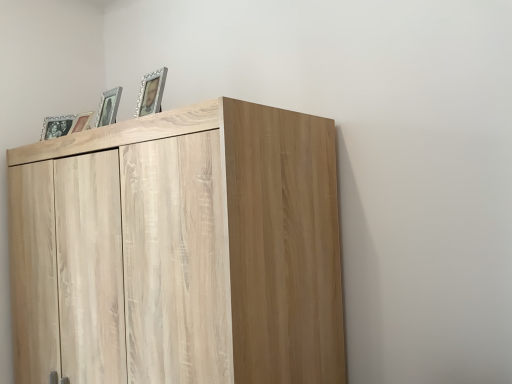
Measure the distance between silver metallic photo frame at upper center, the fourth picture frame viewed from the back, and camera.

The distance of silver metallic photo frame at upper center, the fourth picture frame viewed from the back, from camera is 4.08 feet.

What do you see at coordinates (151, 93) in the screenshot? I see `silver metallic photo frame at upper center, the fourth picture frame viewed from the back` at bounding box center [151, 93].

Where is `matte black picture frame at upper left, which appears as the first picture frame when viewed from the back`? The image size is (512, 384). matte black picture frame at upper left, which appears as the first picture frame when viewed from the back is located at coordinates (56, 126).

What do you see at coordinates (56, 126) in the screenshot? I see `matte black picture frame at upper left, which is the first picture frame from left to right` at bounding box center [56, 126].

Identify the location of matte silver picture frame at upper left, the 3th picture frame when ordered from left to right. (109, 107).

Is matte silver picture frame at upper left, which appears as the third picture frame when viewed from the back, not near silver metallic photo frame at upper center, marked as the 4th picture frame in a left-to-right arrangement?

No, matte silver picture frame at upper left, which appears as the third picture frame when viewed from the back, is in close proximity to silver metallic photo frame at upper center, marked as the 4th picture frame in a left-to-right arrangement.

Considering the points (113, 103) and (138, 109), which point is behind, point (113, 103) or point (138, 109)?

The point (138, 109) is farther from the camera.

Is matte silver picture frame at upper left, which appears as the third picture frame when viewed from the back, oriented away from silver metallic photo frame at upper center, marked as the 4th picture frame in a left-to-right arrangement?

No, matte silver picture frame at upper left, which appears as the third picture frame when viewed from the back, is not facing away from silver metallic photo frame at upper center, marked as the 4th picture frame in a left-to-right arrangement.

From the image's perspective, is light wood cupboard at upper left below matte black picture frame at upper left, which is the fourth picture frame in right-to-left order?

Yes, from the image's perspective, light wood cupboard at upper left is below matte black picture frame at upper left, which is the fourth picture frame in right-to-left order.

From a real-world perspective, which is physically above, light wood cupboard at upper left or matte black picture frame at upper left, positioned as the fourth picture frame in front-to-back order?

From a 3D spatial view, matte black picture frame at upper left, positioned as the fourth picture frame in front-to-back order, is above.

Which picture frame is the 3rd one when counting from the left side of the light wood cupboard at upper left? Please provide its 2D coordinates.

[(56, 126)]

Does matte black picture frame at upper left, which is the fourth picture frame in right-to-left order, have a greater width compared to light wood cupboard at upper left?

In fact, matte black picture frame at upper left, which is the fourth picture frame in right-to-left order, might be narrower than light wood cupboard at upper left.

From the image's perspective, is matte black picture frame at upper left, which is the fourth picture frame in right-to-left order, located above light wood cupboard at upper left?

Correct, matte black picture frame at upper left, which is the fourth picture frame in right-to-left order, appears higher than light wood cupboard at upper left in the image.

Is light wood cupboard at upper left at the back of matte black picture frame at upper left, which appears as the first picture frame when viewed from the back?

matte black picture frame at upper left, which appears as the first picture frame when viewed from the back, is not turned away from light wood cupboard at upper left.

Considering the sizes of light wood cupboard at upper left and matte silver picture frame at upper left, the second picture frame positioned from the right, in the image, is light wood cupboard at upper left taller or shorter than matte silver picture frame at upper left, the second picture frame positioned from the right,?

Clearly, light wood cupboard at upper left is taller compared to matte silver picture frame at upper left, the second picture frame positioned from the right.

Choose the correct answer: Is light wood cupboard at upper left inside matte silver picture frame at upper left, which appears as the third picture frame when viewed from the back, or outside it?

light wood cupboard at upper left cannot be found inside matte silver picture frame at upper left, which appears as the third picture frame when viewed from the back.

Locate an element on the screen. Image resolution: width=512 pixels, height=384 pixels. cupboard on the right of the matte silver picture frame at upper left, the 3th picture frame when ordered from left to right is located at coordinates (179, 250).

Between light wood cupboard at upper left and matte silver picture frame at upper left, which appears as the third picture frame when viewed from the back, which one appears on the left side from the viewer's perspective?

Positioned to the left is matte silver picture frame at upper left, which appears as the third picture frame when viewed from the back.

How many degrees apart are the facing directions of matte silver picture frame at upper left, the 3th picture frame when ordered from left to right, and light wood cupboard at upper left?

matte silver picture frame at upper left, the 3th picture frame when ordered from left to right, and light wood cupboard at upper left are facing 1.79 degrees away from each other.

Locate an element on the screen. The height and width of the screenshot is (384, 512). cupboard directly beneath the matte silver picture frame at upper left, which ranks as the 2th picture frame in front-to-back order (from a real-world perspective) is located at coordinates (179, 250).

From a real-world perspective, who is located higher, matte silver picture frame at upper left, which ranks as the 2th picture frame in front-to-back order, or light wood cupboard at upper left?

matte silver picture frame at upper left, which ranks as the 2th picture frame in front-to-back order, from a real-world perspective.

Between matte silver picture frame at upper left, the second picture frame positioned from the right, and light wood cupboard at upper left, which one is positioned in front?

light wood cupboard at upper left is closer to the camera.

Based on the photo, who is taller, matte wooden picture frame at upper left, which is the 2th picture frame from left to right, or matte silver picture frame at upper left, which appears as the third picture frame when viewed from the back?

matte silver picture frame at upper left, which appears as the third picture frame when viewed from the back.

From the image's perspective, count 1st picture frames upward from the matte wooden picture frame at upper left, the 3th picture frame when ordered from right to left, and point to it. Please provide its 2D coordinates.

[(109, 107)]

Is silver metallic photo frame at upper center, the 1th picture frame from the right, directly adjacent to matte wooden picture frame at upper left, which appears as the second picture frame when viewed from the back?

silver metallic photo frame at upper center, the 1th picture frame from the right, and matte wooden picture frame at upper left, which appears as the second picture frame when viewed from the back, are not in contact.

Is silver metallic photo frame at upper center, the fourth picture frame viewed from the back, thinner than matte wooden picture frame at upper left, the 3th picture frame positioned from the front?

In fact, silver metallic photo frame at upper center, the fourth picture frame viewed from the back, might be wider than matte wooden picture frame at upper left, the 3th picture frame positioned from the front.

From the picture: Is silver metallic photo frame at upper center, marked as the 4th picture frame in a left-to-right arrangement, not inside matte wooden picture frame at upper left, which is the 2th picture frame from left to right?

silver metallic photo frame at upper center, marked as the 4th picture frame in a left-to-right arrangement, lies outside matte wooden picture frame at upper left, which is the 2th picture frame from left to right,'s area.

Starting from the silver metallic photo frame at upper center, marked as the 4th picture frame in a left-to-right arrangement, which picture frame is the 1st one to the left? Please provide its 2D coordinates.

[(109, 107)]

This screenshot has width=512, height=384. Find the location of `picture frame that is the 2nd object above the light wood cupboard at upper left (from a real-world perspective)`. picture frame that is the 2nd object above the light wood cupboard at upper left (from a real-world perspective) is located at coordinates (56, 126).

From the image, which object appears to be farther from matte silver picture frame at upper left, which appears as the third picture frame when viewed from the back, matte black picture frame at upper left, positioned as the fourth picture frame in front-to-back order, or matte wooden picture frame at upper left, the 3th picture frame positioned from the front?

matte black picture frame at upper left, positioned as the fourth picture frame in front-to-back order, is positioned further to the anchor matte silver picture frame at upper left, which appears as the third picture frame when viewed from the back.

When comparing their distances from light wood cupboard at upper left, does matte silver picture frame at upper left, the 3th picture frame when ordered from left to right, or silver metallic photo frame at upper center, which is the 1th picture frame in front-to-back order, seem closer?

Based on the image, silver metallic photo frame at upper center, which is the 1th picture frame in front-to-back order, appears to be nearer to light wood cupboard at upper left.

Based on their spatial positions, is matte black picture frame at upper left, positioned as the fourth picture frame in front-to-back order, or matte wooden picture frame at upper left, which appears as the second picture frame when viewed from the back, closer to silver metallic photo frame at upper center, which is the 1th picture frame in front-to-back order?

Among the two, matte wooden picture frame at upper left, which appears as the second picture frame when viewed from the back, is located nearer to silver metallic photo frame at upper center, which is the 1th picture frame in front-to-back order.

Which object lies further to the anchor point light wood cupboard at upper left, matte wooden picture frame at upper left, the 3th picture frame when ordered from right to left, or matte silver picture frame at upper left, which appears as the third picture frame when viewed from the back?

The object further to light wood cupboard at upper left is matte wooden picture frame at upper left, the 3th picture frame when ordered from right to left.

Based on their spatial positions, is matte silver picture frame at upper left, the second picture frame positioned from the right, or matte wooden picture frame at upper left, the 3th picture frame when ordered from right to left, further from matte black picture frame at upper left, which is the first picture frame from left to right?

matte silver picture frame at upper left, the second picture frame positioned from the right, is further to matte black picture frame at upper left, which is the first picture frame from left to right.

Based on the photo, estimate the real-world distances between objects in this image. Which object is closer to light wood cupboard at upper left, matte wooden picture frame at upper left, which is the 2th picture frame from left to right, or matte black picture frame at upper left, which is the fourth picture frame in right-to-left order?

matte wooden picture frame at upper left, which is the 2th picture frame from left to right.

Estimate the real-world distances between objects in this image. Which object is closer to silver metallic photo frame at upper center, marked as the 4th picture frame in a left-to-right arrangement, matte silver picture frame at upper left, the second picture frame positioned from the right, or matte wooden picture frame at upper left, which is the 2th picture frame from left to right?

matte silver picture frame at upper left, the second picture frame positioned from the right, is positioned closer to the anchor silver metallic photo frame at upper center, marked as the 4th picture frame in a left-to-right arrangement.

Estimate the real-world distances between objects in this image. Which object is closer to matte wooden picture frame at upper left, the 3th picture frame when ordered from right to left, matte silver picture frame at upper left, the second picture frame positioned from the right, or silver metallic photo frame at upper center, which is the 1th picture frame in front-to-back order?

matte silver picture frame at upper left, the second picture frame positioned from the right.

At what (x,y) coordinates should I click in order to perform the action: click on picture frame situated between matte black picture frame at upper left, positioned as the fourth picture frame in front-to-back order, and matte silver picture frame at upper left, which ranks as the 2th picture frame in front-to-back order, from left to right. Please return your answer as a coordinate pair (x, y). This screenshot has width=512, height=384. Looking at the image, I should click on (81, 122).

This screenshot has height=384, width=512. What are the coordinates of `picture frame that lies between matte wooden picture frame at upper left, the 3th picture frame when ordered from right to left, and light wood cupboard at upper left from top to bottom` in the screenshot? It's located at (56, 126).

You are a GUI agent. You are given a task and a screenshot of the screen. Output one action in this format:
    pyautogui.click(x=<x>, y=<y>)
    Task: Click on the picture frame situated between matte wooden picture frame at upper left, which is the 2th picture frame from left to right, and silver metallic photo frame at upper center, which is the 1th picture frame in front-to-back order, from left to right
    
    Given the screenshot: What is the action you would take?
    pyautogui.click(x=109, y=107)